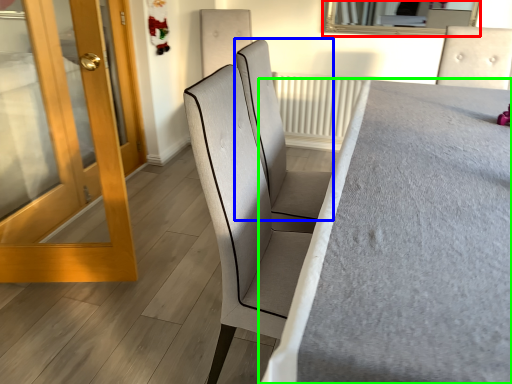
Question: Which is farther away from mirror (highlighted by a red box)? chair (highlighted by a blue box) or furniture (highlighted by a green box)?

Choices:
 (A) chair
 (B) furniture

Answer: (A)